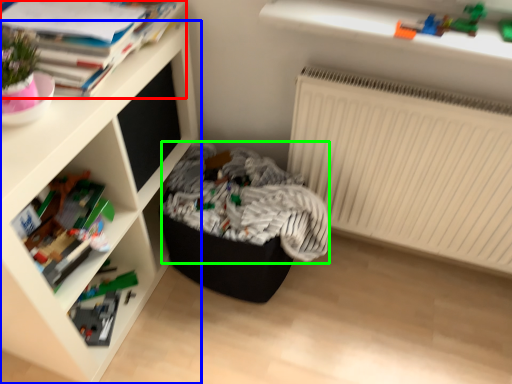
Question: Considering the real-world distances, which object is closest to book (highlighted by a red box)? shelf (highlighted by a blue box) or laundry (highlighted by a green box).

Choices:
 (A) shelf
 (B) laundry

Answer: (A)